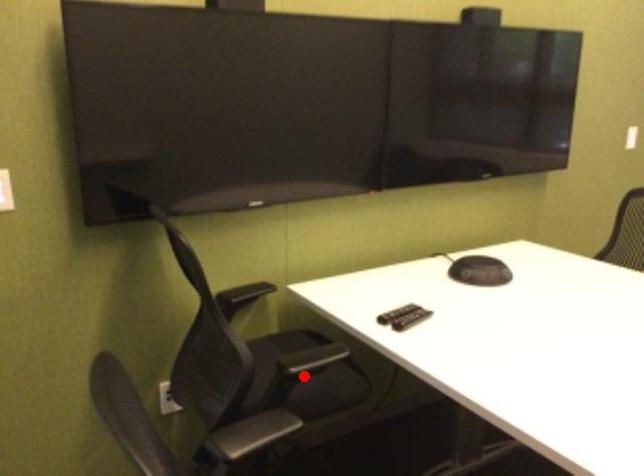
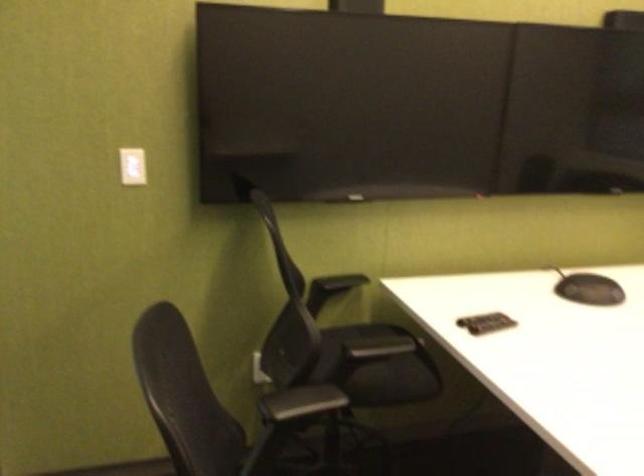
Question: I am providing you with two images of the same scene from different viewpoints. A red point is marked on the first image. At the location where the point appears in image 1, is it still visible in image 2?

Choices:
 (A) Yes
 (B) No

Answer: (B)